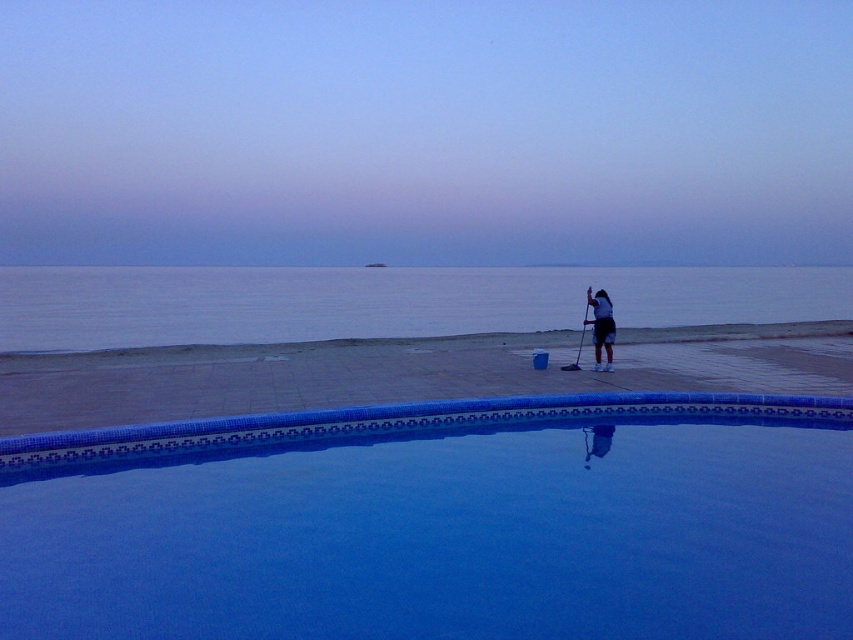
You are planning to place a large floating platform in the water. Based on the scene, which area between the blue glossy pool at center and the smooth concrete beach at center can accommodate the platform?

The blue glossy pool at center is thinner than the smooth concrete beach at center, so the platform should be placed in the smooth concrete beach at center since it is wider.